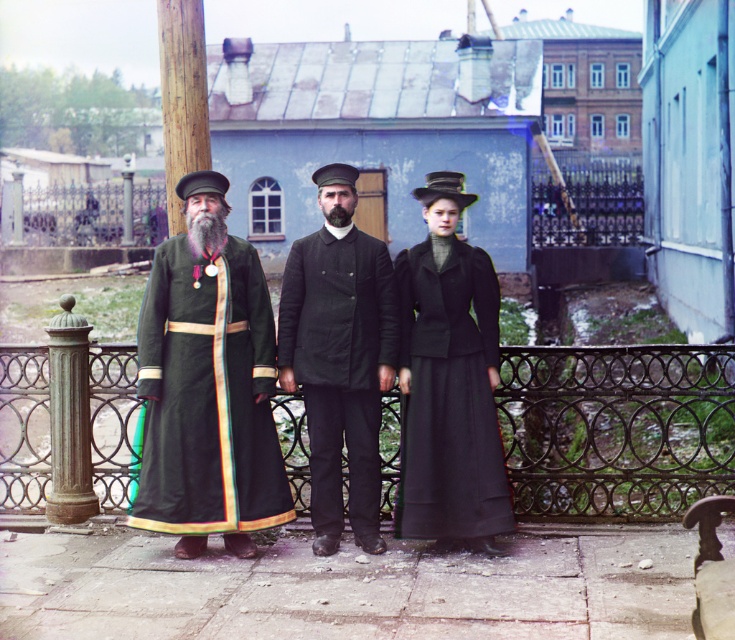
Question: Is the position of iron wire fence at center less distant than that of graywoollybeard at center?

Choices:
 (A) no
 (B) yes

Answer: (A)

Question: Can you confirm if velvet green robe at center is thinner than graywoollybeard at center?

Choices:
 (A) no
 (B) yes

Answer: (A)

Question: Which object is farther from the camera taking this photo?

Choices:
 (A) brown fuzzy beard at center
 (B) graywoollybeard at center
 (C) dark wool coat at center

Answer: (A)

Question: Which object is the farthest from the iron wire fence at center?

Choices:
 (A) matte black dress at center
 (B) dark green velvet coat at center

Answer: (A)

Question: Which point is farther from the camera taking this photo?

Choices:
 (A) (104, 445)
 (B) (441, 474)
 (C) (284, 371)

Answer: (A)

Question: Does iron wire fence at center have a greater width compared to velvet green robe at center?

Choices:
 (A) no
 (B) yes

Answer: (B)